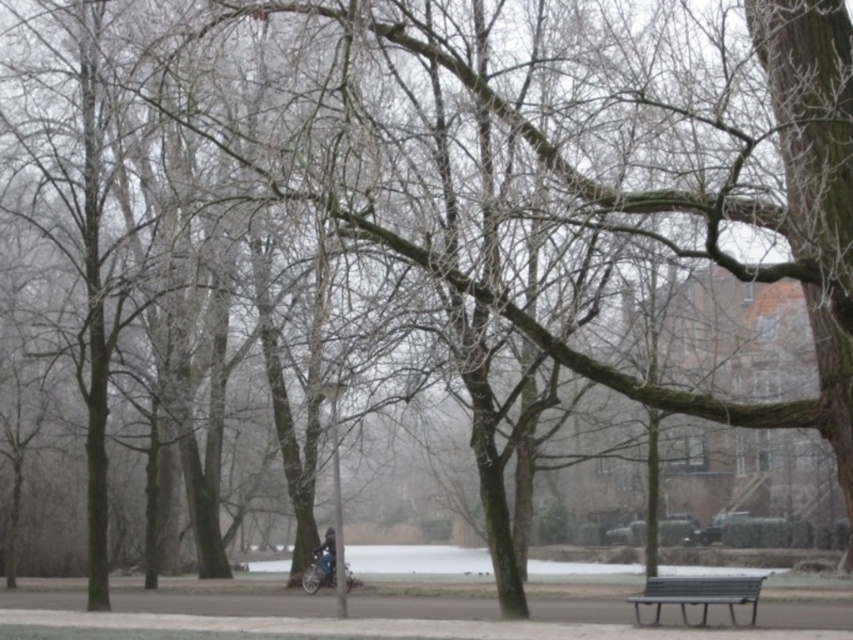
Is metallic gray bench at lower right taller than dark blue jacket at center?

Yes.

Which is in front, point (747, 600) or point (322, 548)?

Point (747, 600)

What are the coordinates of `metallic gray bench at lower right` in the screenshot? It's located at (698, 593).